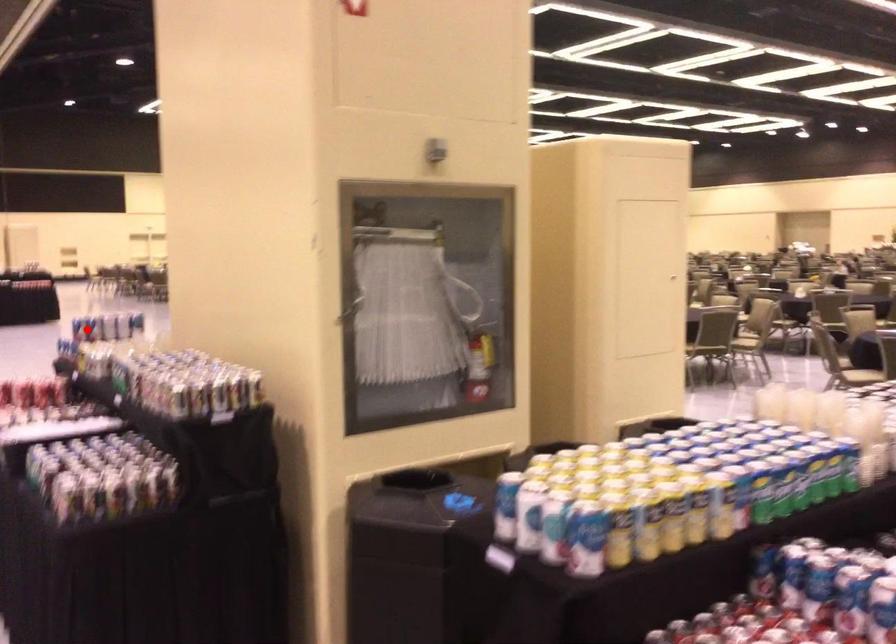
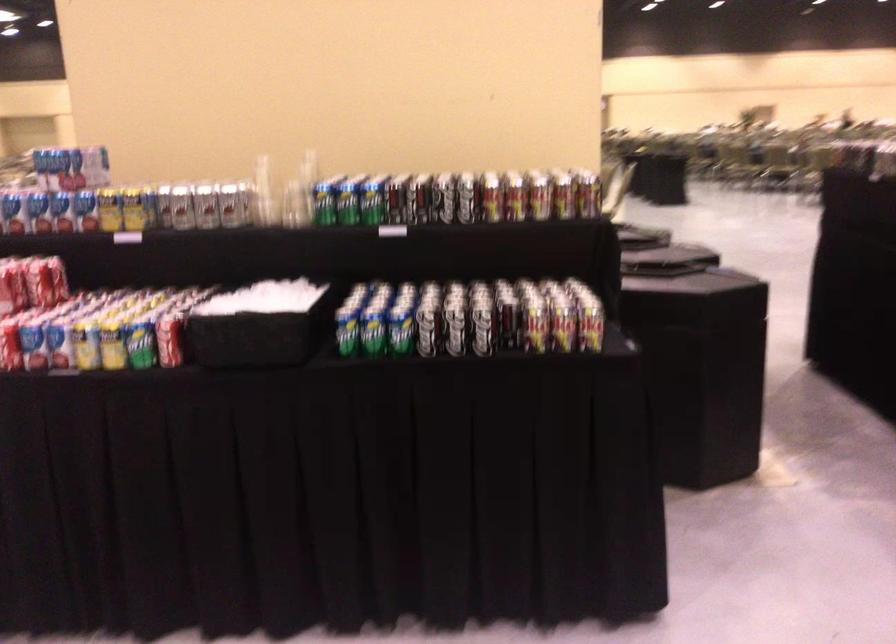
Question: I am providing you with two images of the same scene from different viewpoints. A red point is shown in image1. For the corresponding object point in image2, is it positioned nearer or farther from the camera?

Choices:
 (A) Nearer
 (B) Farther

Answer: (A)